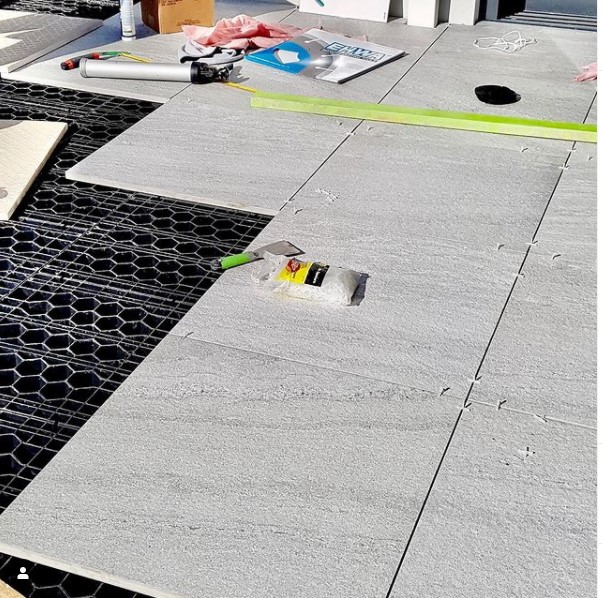
In order to click on underlayment in this screenshot , I will do `click(106, 347)`.